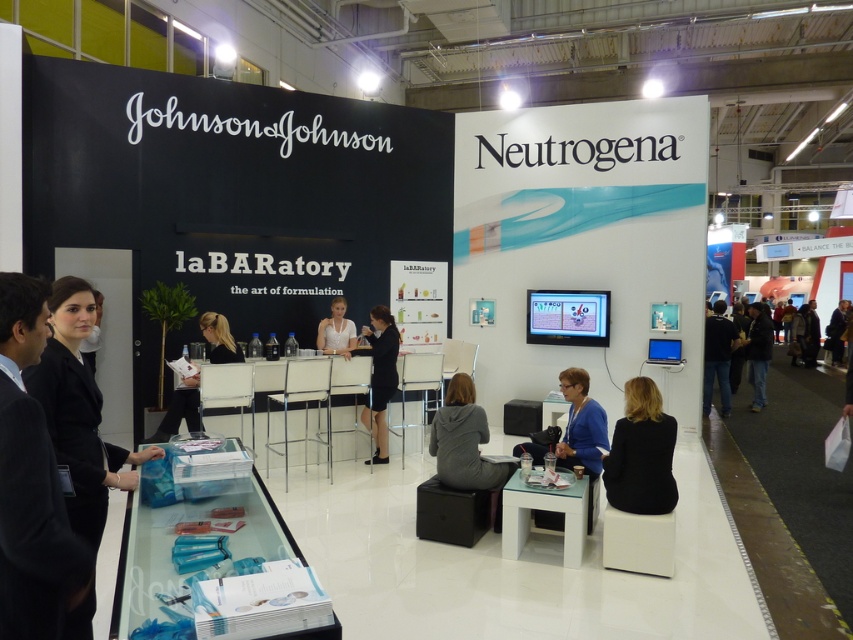
Question: Is black fabric at left in front of dark blue shirt at center?

Choices:
 (A) yes
 (B) no

Answer: (A)

Question: Is dark blue shirt at center thinner than white matte shirt at center?

Choices:
 (A) yes
 (B) no

Answer: (B)

Question: Is black fabric coat at lower right above blue fabric jacket at lower center?

Choices:
 (A) no
 (B) yes

Answer: (B)

Question: Which object is the farthest from the dark blue jeans at lower right?

Choices:
 (A) blonde hair at center
 (B) black fabric dress at center
 (C) black fabric at left

Answer: (C)

Question: Which object is closer to the camera taking this photo?

Choices:
 (A) white matte shirt at center
 (B) black fabric coat at lower right
 (C) dark blue jeans at lower right

Answer: (B)

Question: Based on their relative distances, which object is nearer to the black fabric at left?

Choices:
 (A) gray hoodie at center
 (B) blue fabric jacket at lower center

Answer: (A)